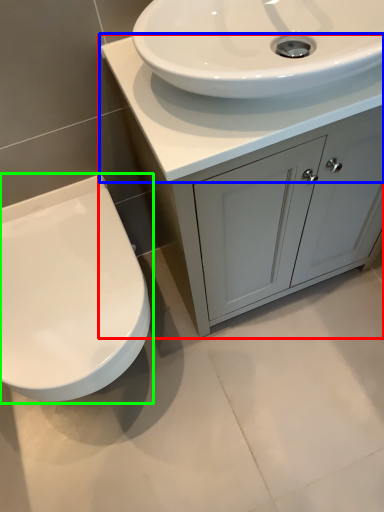
Question: Which object is the farthest from bathroom cabinet (highlighted by a red box)? Choose among these: counter top (highlighted by a blue box) or toilet (highlighted by a green box).

Choices:
 (A) counter top
 (B) toilet

Answer: (B)